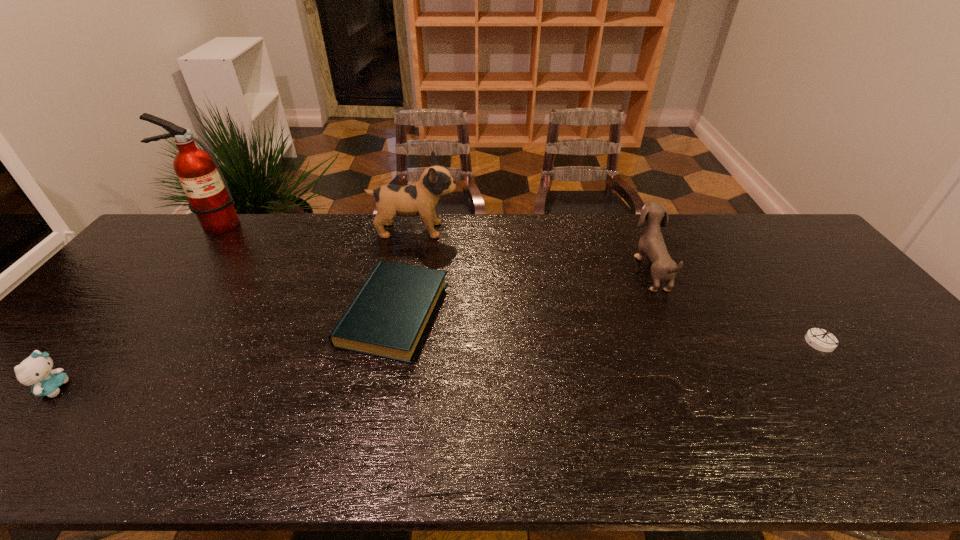
Locate an element on the screen. free point between the compass and the taller puppy is located at coordinates (617, 286).

Locate an element on the screen. The width and height of the screenshot is (960, 540). vacant space in between the third tallest object and the rightmost object is located at coordinates (735, 306).

Image resolution: width=960 pixels, height=540 pixels. Find the location of `vacant area that lies between the book and the fourth tallest object`. vacant area that lies between the book and the fourth tallest object is located at coordinates (224, 351).

At what (x,y) coordinates should I click in order to perform the action: click on vacant region between the nearest object and the compass. Please return your answer as a coordinate pair (x, y). Image resolution: width=960 pixels, height=540 pixels. Looking at the image, I should click on (437, 365).

Identify the location of vacant area that lies between the third shortest object and the tallest object. point(133,306).

The image size is (960, 540). I want to click on empty space between the fourth shortest object and the taller puppy, so click(533, 249).

Choose which object is the second nearest neighbor to the taller puppy. Please provide its 2D coordinates. Your answer should be formatted as a tuple, i.e. [(x, y)], where the tuple contains the x and y coordinates of a point satisfying the conditions above.

[(209, 197)]

I want to click on object that is the closest one to the fifth object from left to right, so click(x=822, y=340).

Identify the location of free location that satisfies the following two spatial constraints: 1. on the nozzle and handle of the book; 2. on the right side of the fire extinguisher. This screenshot has width=960, height=540. (142, 313).